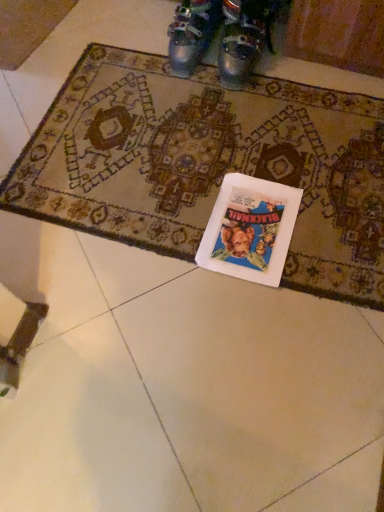
Locate an element on the screen. Image resolution: width=384 pixels, height=512 pixels. vacant area that lies to the right of white paper book at center is located at coordinates (336, 219).